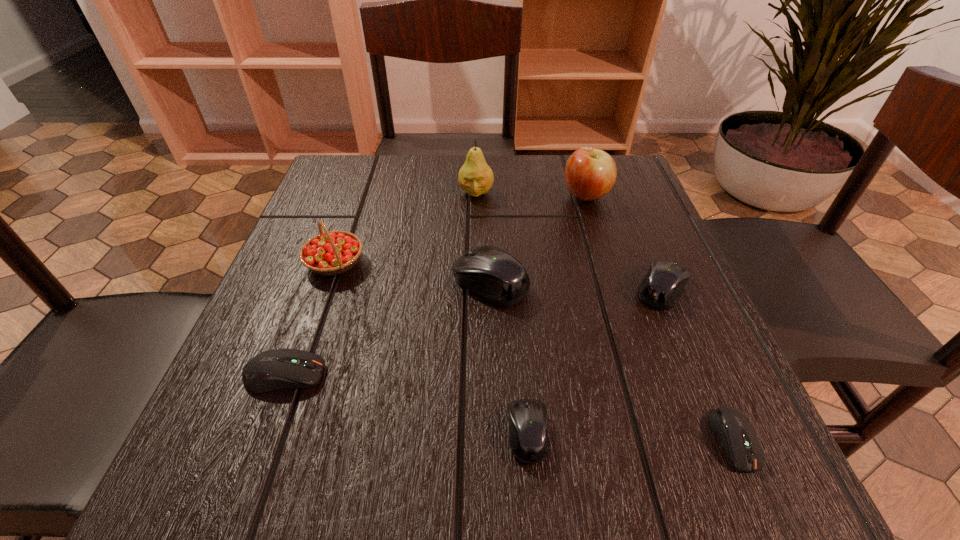
Where is `the smallest black mouse`? the smallest black mouse is located at coordinates (528, 418).

Locate an element on the screen. The image size is (960, 540). the shortest object is located at coordinates (735, 432).

Image resolution: width=960 pixels, height=540 pixels. Identify the location of the right dark computer equipment. (735, 432).

This screenshot has height=540, width=960. In order to click on vacant space located 0.140m on the right of the tallest object in this screenshot , I will do `click(554, 193)`.

At what (x,y) coordinates should I click in order to perform the action: click on blank space located on the back of the apple. Please return your answer as a coordinate pair (x, y). Looking at the image, I should click on (575, 161).

Locate an element on the screen. The width and height of the screenshot is (960, 540). free space located 0.190m on the front of the brown strawberry is located at coordinates (297, 373).

You are a GUI agent. You are given a task and a screenshot of the screen. Output one action in this format:
    pyautogui.click(x=<x>, y=<y>)
    Task: Click on the vacant space located on the back of the fifth shortest object
    
    Given the screenshot: What is the action you would take?
    pyautogui.click(x=487, y=160)

Find the location of `free location located 0.120m on the back of the fifth tallest object`. free location located 0.120m on the back of the fifth tallest object is located at coordinates (637, 228).

Locate an element on the screen. free space located on the button of the bigger dark computer equipment is located at coordinates (418, 375).

Where is `vacant position located 0.110m on the right of the smallest black mouse`? This screenshot has width=960, height=540. vacant position located 0.110m on the right of the smallest black mouse is located at coordinates (630, 433).